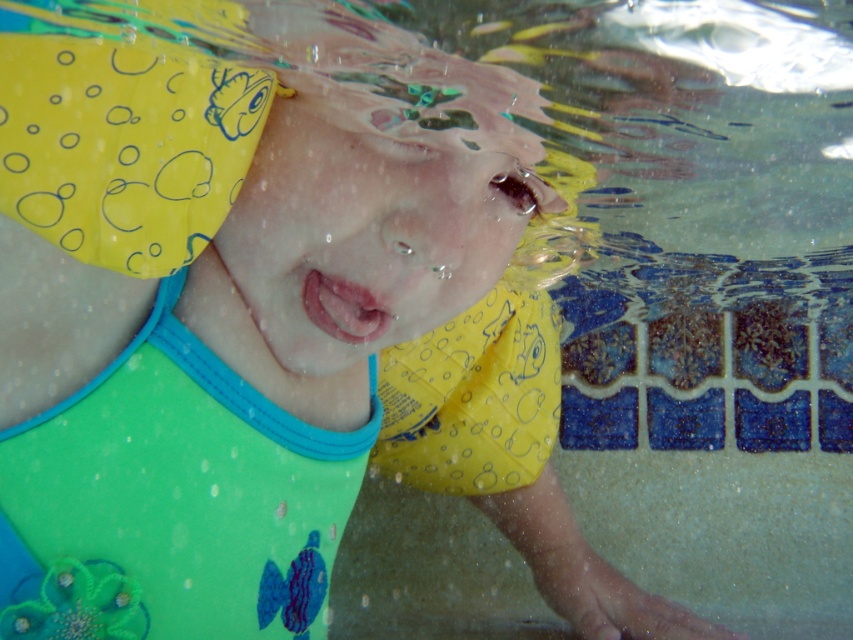
Question: Among these points, which one is nearest to the camera?

Choices:
 (A) (20, 154)
 (B) (93, 620)

Answer: (A)

Question: Which object is farther from the camera taking this photo?

Choices:
 (A) green fabric bib at center
 (B) yellow rubbery swim cap at upper left

Answer: (A)

Question: Does green fabric bib at center come behind yellow rubbery swim cap at upper left?

Choices:
 (A) yes
 (B) no

Answer: (A)

Question: Which object is closer to the camera taking this photo?

Choices:
 (A) green fabric bib at center
 (B) yellow rubbery swim cap at upper left

Answer: (B)

Question: Is green fabric bib at center closer to the viewer compared to yellow rubbery swim cap at upper left?

Choices:
 (A) no
 (B) yes

Answer: (A)

Question: Is green fabric bib at center thinner than yellow rubbery swim cap at upper left?

Choices:
 (A) yes
 (B) no

Answer: (B)